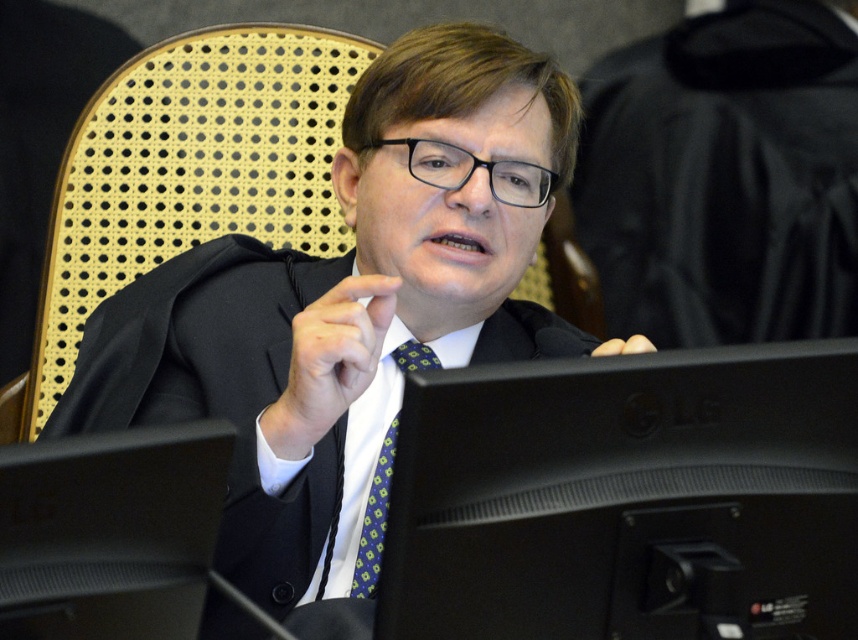
You are setting up a presentation and need to ensure that the black plastic monitor at center will fit on a desk that can only accommodate items up to the size of the green checkered tie at center. Based on the scene description, will the monitor fit?

The black plastic monitor at center has a larger width than the green checkered tie at center, so it will not fit on the desk that can only accommodate items up to the size of the green checkered tie at center.

You are observing a person in a formal setting. The person is pointing with their right hand. There are two points marked in the image. The first point is at coordinates point (512, 163) and the second point is at point (418, 362). Which of these two points is closer to the camera?

Point (512, 163) is closer to the camera than point (418, 362).

You are an office assistant who needs to place a new keyboard on the desk. The keyboard requires 20 cm of space. Can the black plastic monitor at center and the green checkered tie at center accommodate this requirement?

The black plastic monitor at center is smaller than the green checkered tie at center, but the exact dimensions of the monitor and the tie are not provided. Therefore, it is unclear if there is enough space to place the keyboard.